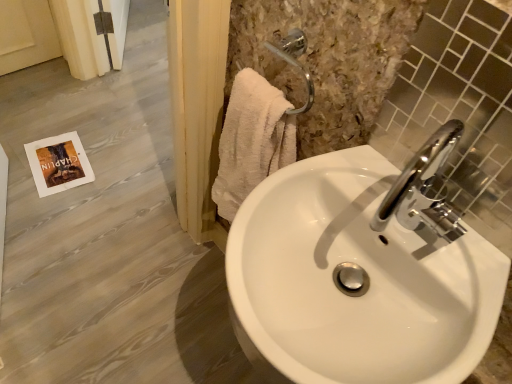
Question: Would you say chrome metallic faucet at upper right is outside white glossy sink at center?

Choices:
 (A) no
 (B) yes

Answer: (B)

Question: From a real-world perspective, is chrome metallic faucet at upper right below white glossy sink at center?

Choices:
 (A) no
 (B) yes

Answer: (A)

Question: Is chrome metallic faucet at upper right oriented towards white glossy sink at center?

Choices:
 (A) no
 (B) yes

Answer: (A)

Question: From a real-world perspective, is chrome metallic faucet at upper right over white glossy sink at center?

Choices:
 (A) no
 (B) yes

Answer: (B)

Question: Is there a large distance between chrome metallic faucet at upper right and white glossy sink at center?

Choices:
 (A) no
 (B) yes

Answer: (A)

Question: In terms of size, does chrome metallic faucet at upper right appear bigger or smaller than white glossy sink at center?

Choices:
 (A) big
 (B) small

Answer: (B)

Question: From the image's perspective, is chrome metallic faucet at upper right located above or below white glossy sink at center?

Choices:
 (A) above
 (B) below

Answer: (A)

Question: From their relative heights in the image, would you say chrome metallic faucet at upper right is taller or shorter than white glossy sink at center?

Choices:
 (A) tall
 (B) short

Answer: (A)

Question: Is chrome metallic faucet at upper right in front of or behind white glossy sink at center in the image?

Choices:
 (A) front
 (B) behind

Answer: (A)

Question: Based on their sizes in the image, would you say white fluffy towel at upper right is bigger or smaller than chrome metallic faucet at upper right?

Choices:
 (A) big
 (B) small

Answer: (A)

Question: From a real-world perspective, relative to chrome metallic faucet at upper right, is white fluffy towel at upper right vertically above or below?

Choices:
 (A) above
 (B) below

Answer: (B)

Question: From their relative heights in the image, would you say white fluffy towel at upper right is taller or shorter than chrome metallic faucet at upper right?

Choices:
 (A) short
 (B) tall

Answer: (A)

Question: From the image's perspective, relative to chrome metallic faucet at upper right, is white fluffy towel at upper right above or below?

Choices:
 (A) below
 (B) above

Answer: (B)

Question: Is chrome metallic faucet at upper right bigger or smaller than white glossy sink at center?

Choices:
 (A) small
 (B) big

Answer: (A)

Question: In terms of height, does chrome metallic faucet at upper right look taller or shorter compared to white glossy sink at center?

Choices:
 (A) tall
 (B) short

Answer: (B)